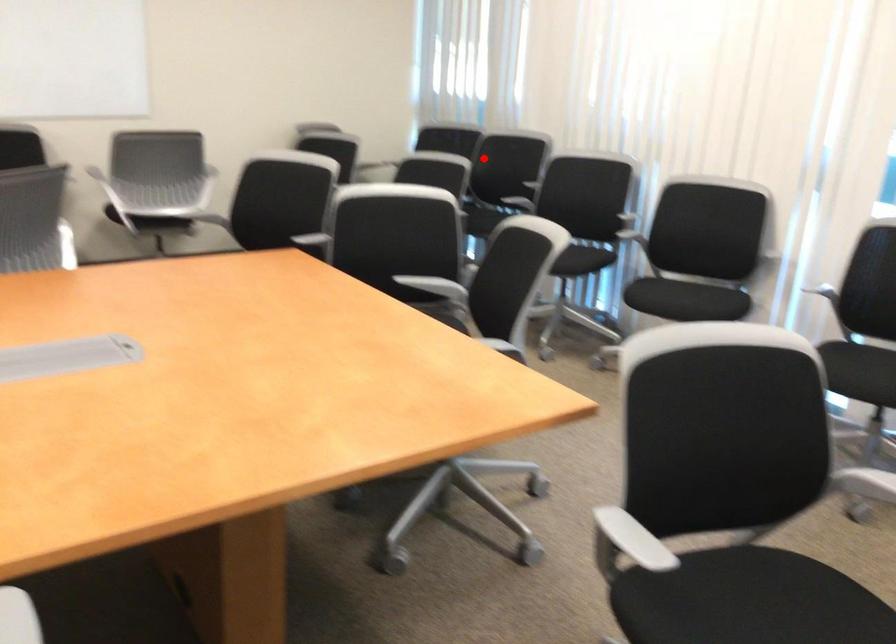
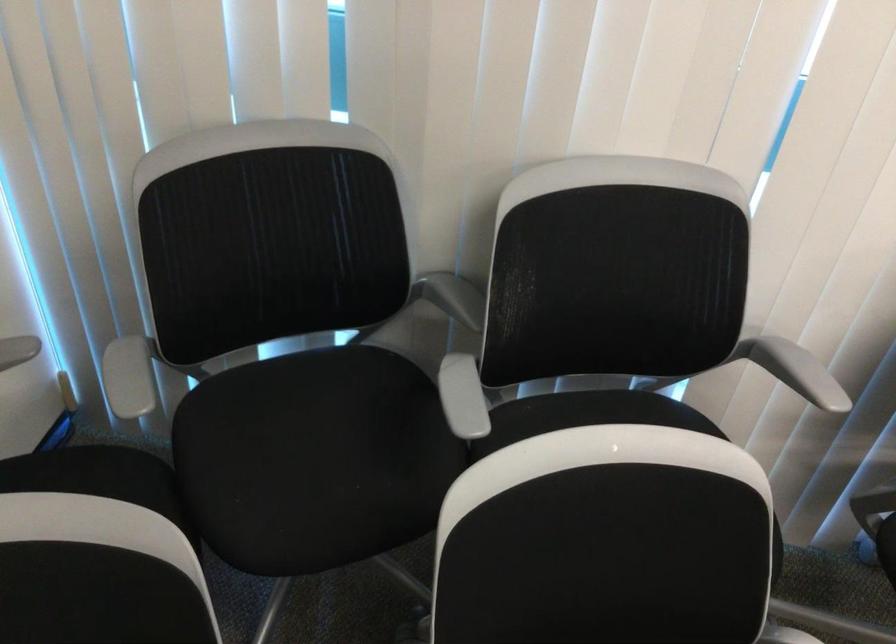
In the second image, find the point that corresponds to the highlighted location in the first image.

(453, 297)